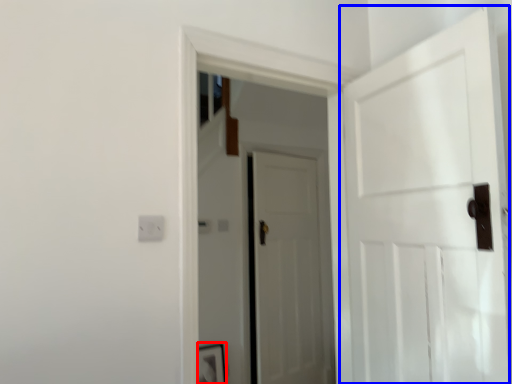
Question: Among these objects, which one is farthest to the camera, picture frame (highlighted by a red box) or door (highlighted by a blue box)?

Choices:
 (A) picture frame
 (B) door

Answer: (A)